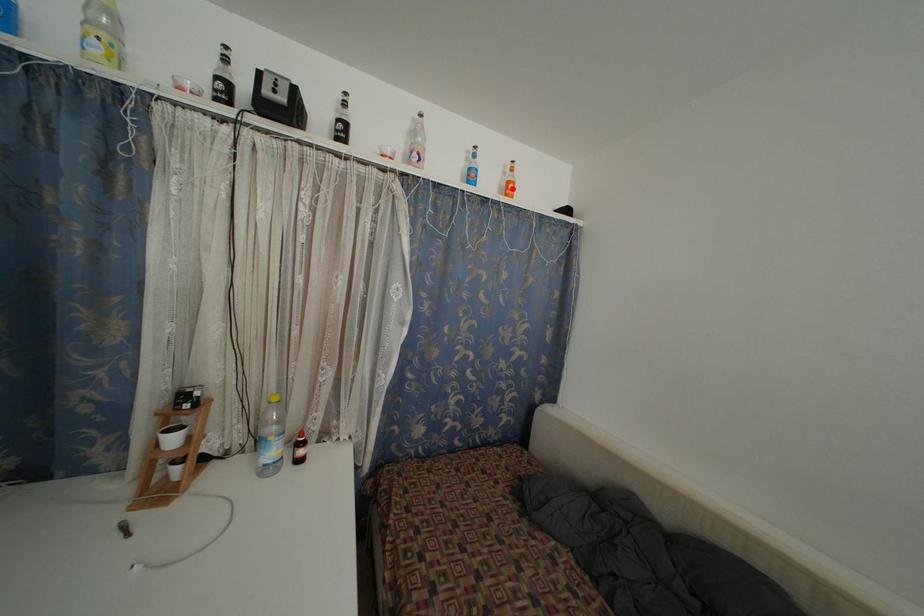
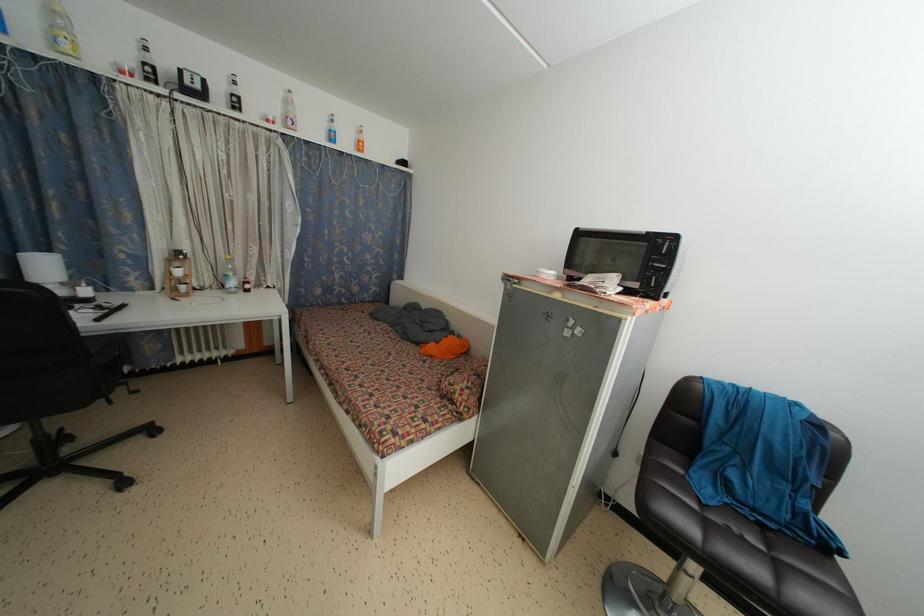
Find the pixel in the second image that matches the highlighted location in the first image.

(362, 147)